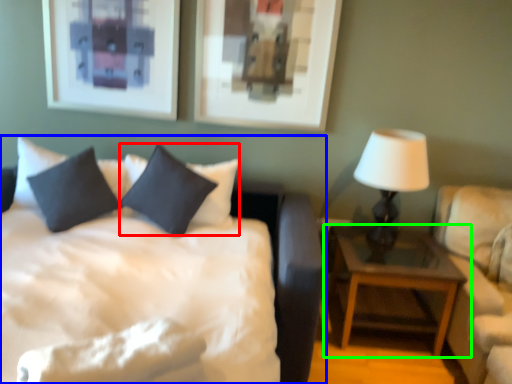
Question: Considering the real-world distances, which object is closest to pillow (highlighted by a red box)? bed (highlighted by a blue box) or nightstand (highlighted by a green box).

Choices:
 (A) bed
 (B) nightstand

Answer: (A)